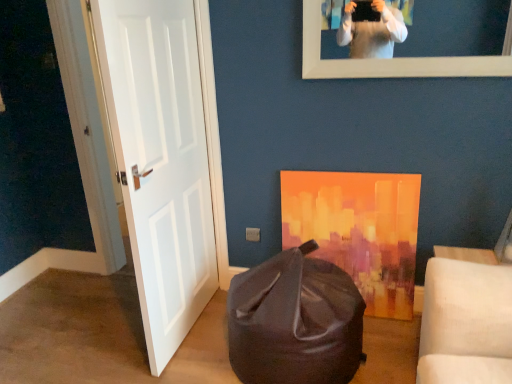
Where is `vacant area situated below white matte door at left (from a real-world perspective)`? Image resolution: width=512 pixels, height=384 pixels. vacant area situated below white matte door at left (from a real-world perspective) is located at coordinates (192, 326).